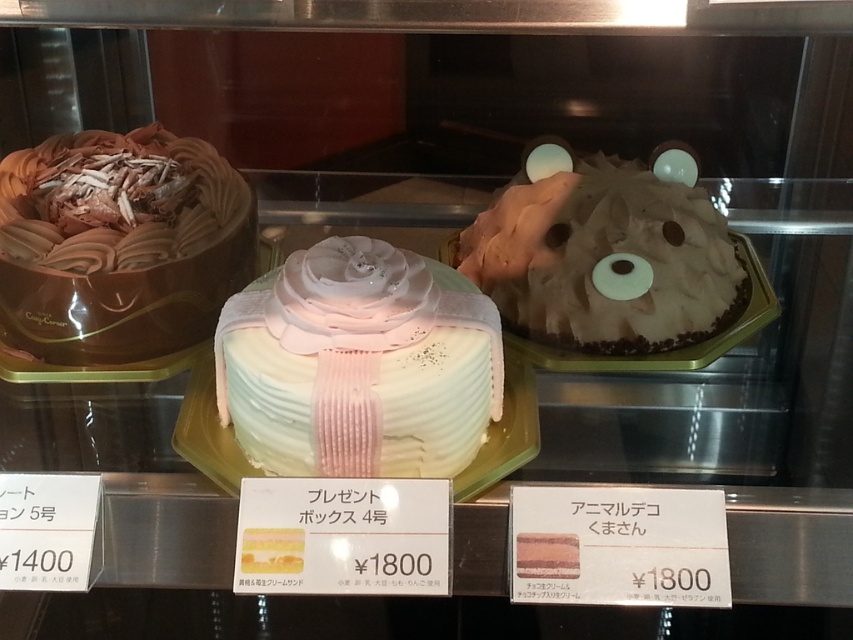
Does white glossy cake at center appear under chocolate frosted cake at left?

Correct, white glossy cake at center is located below chocolate frosted cake at left.

Is white glossy cake at center closer to camera compared to chocolate frosted cake at left?

Yes, it is in front of chocolate frosted cake at left.

Is point (491, 337) closer to viewer compared to point (71, 221)?

Yes, it is in front of point (71, 221).

Where is `white glossy cake at center`? This screenshot has width=853, height=640. white glossy cake at center is located at coordinates (358, 364).

Is white glossy cake at center positioned at the back of white matte bear-shaped cake at upper right?

No.

Does point (341, 348) come in front of point (735, 259)?

Yes, it is in front of point (735, 259).

I want to click on white glossy cake at center, so click(358, 364).

Can you confirm if chocolate frosted cake at left is wider than white matte bear-shaped cake at upper right?

No, chocolate frosted cake at left is not wider than white matte bear-shaped cake at upper right.

Can you confirm if chocolate frosted cake at left is thinner than white matte bear-shaped cake at upper right?

Yes, chocolate frosted cake at left is thinner than white matte bear-shaped cake at upper right.

Which is in front, point (45, 156) or point (730, 308)?

Point (730, 308)

I want to click on chocolate frosted cake at left, so click(x=119, y=244).